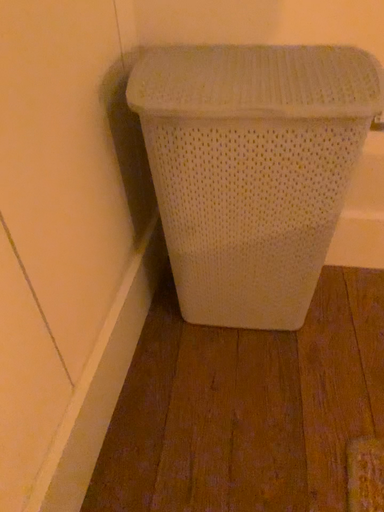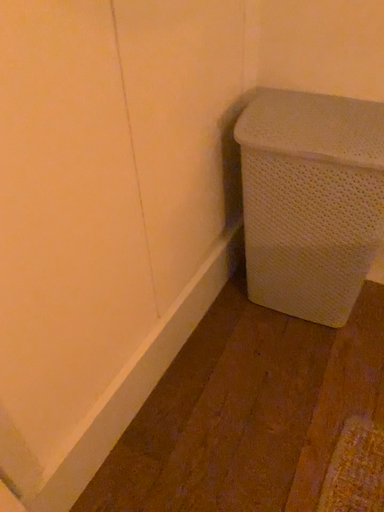
Question: How did the camera likely rotate when shooting the video?

Choices:
 (A) rotated right
 (B) rotated left

Answer: (B)